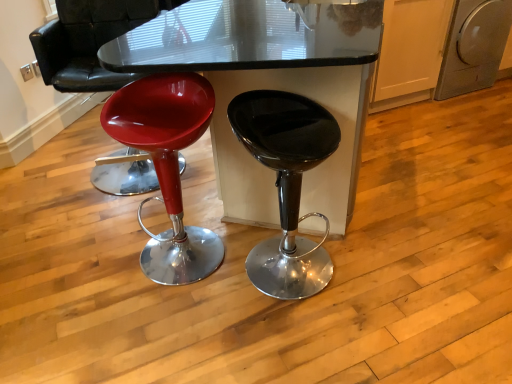
Identify the location of vacant space to the right of glossy black stool at center, the first stool positioned from the right. (384, 275).